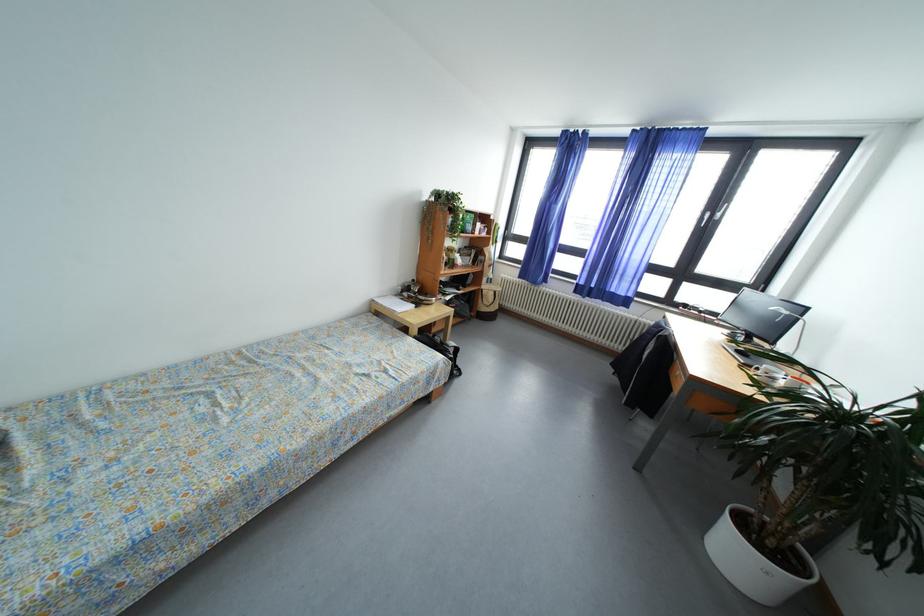
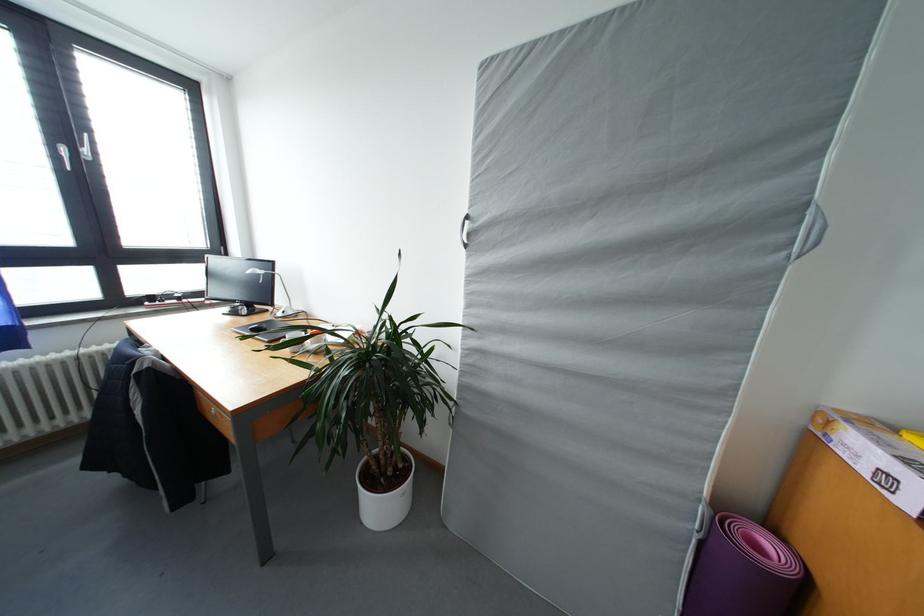
Based on the continuous images, in which direction is the camera rotating?

The rotation direction of the camera is right-down.